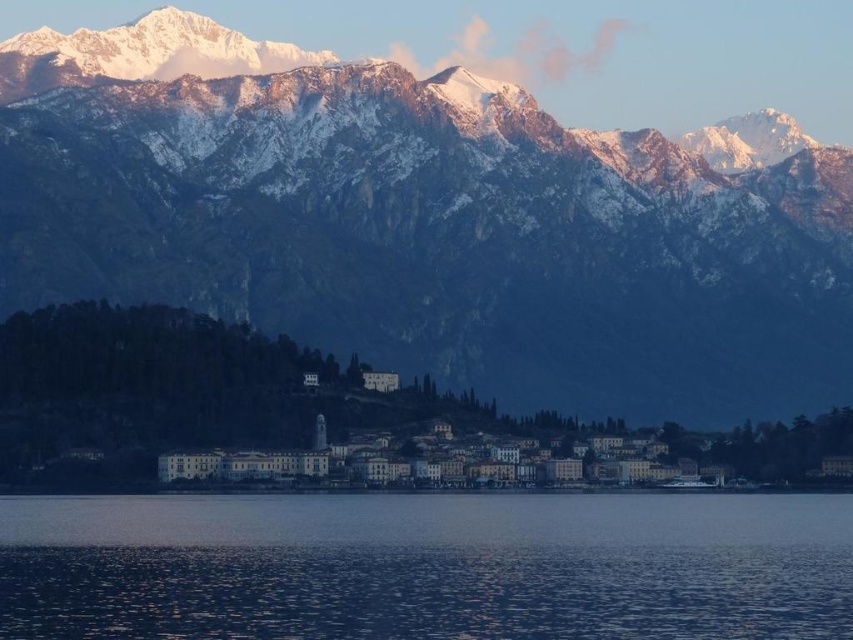
Question: In this image, where is snowy rock mountain range at upper center located relative to blue water at lower center?

Choices:
 (A) right
 (B) left

Answer: (B)

Question: Is snowy rock mountain range at upper center positioned behind blue water at lower center?

Choices:
 (A) yes
 (B) no

Answer: (B)

Question: Does snowy rock mountain range at upper center have a larger size compared to blue water at lower center?

Choices:
 (A) no
 (B) yes

Answer: (B)

Question: Which object appears farthest from the camera in this image?

Choices:
 (A) blue water at lower center
 (B) snowy rock mountain range at upper center

Answer: (A)